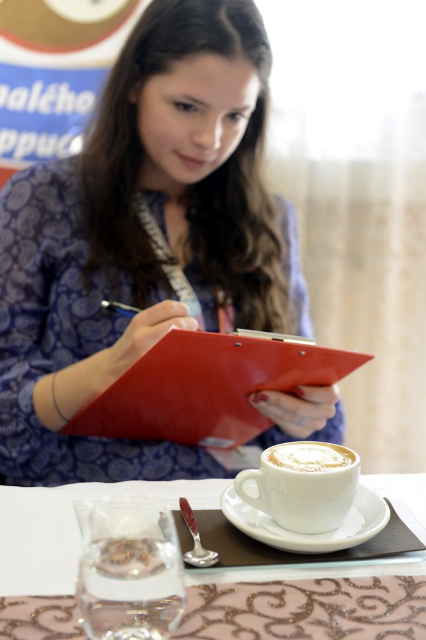
You are a barista preparing a latte. You have a white ceramic cup at center and a white ceramic saucer at lower center. Which item should you use to serve the drink?

The white ceramic cup at center is wider than the white ceramic saucer at lower center, so it should be used to serve the drink as cups are typically designed to hold beverages.

Consider the image. You are a person sitting at the table in the scene. You need to place a small notebook on the table in such a way that it doesn not block the red matte clipboard at center. Where should you place it?

Since the red matte clipboard at center is located at point (207, 387), placing the notebook anywhere else on the table except near that coordinate would ensure it doesn not block the clipboard.